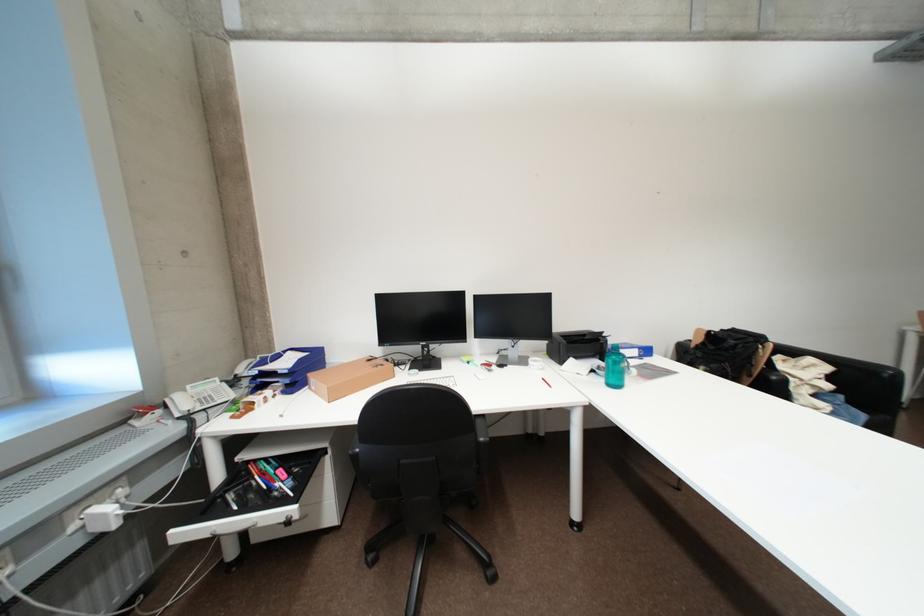
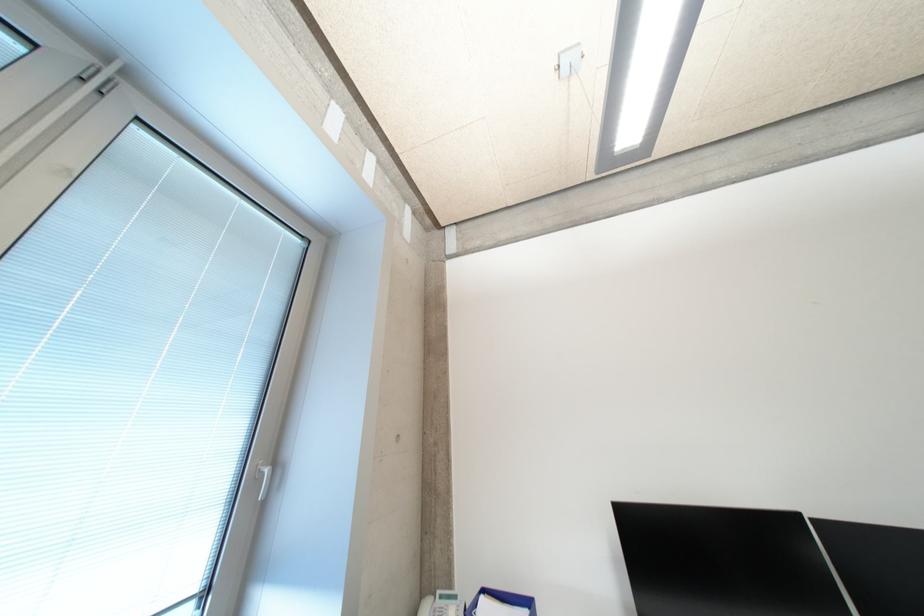
How did the camera likely rotate?

The rotation direction of the camera is left-up.